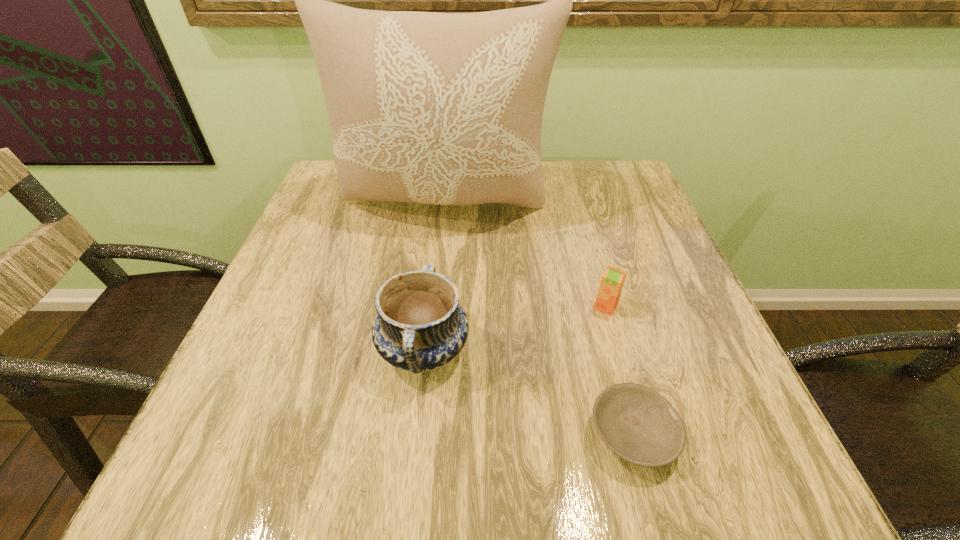
In the image, there is a desktop. Where is `vacant space at the near left corner`? The image size is (960, 540). vacant space at the near left corner is located at coordinates (179, 477).

The width and height of the screenshot is (960, 540). Find the location of `vacant space at the far right corner`. vacant space at the far right corner is located at coordinates (611, 161).

Identify the location of unoccupied position between the bowl and the orange juice. (619, 371).

At what (x,y) coordinates should I click in order to perform the action: click on vacant area between the bowl and the cushion. Please return your answer as a coordinate pair (x, y). This screenshot has width=960, height=540. Looking at the image, I should click on (540, 320).

Where is `free spot between the shortest object and the tallest object`? This screenshot has width=960, height=540. free spot between the shortest object and the tallest object is located at coordinates (540, 320).

This screenshot has height=540, width=960. In order to click on free space between the second shortest object and the tallest object in this screenshot , I will do click(526, 255).

Find the location of a particular element. This screenshot has width=960, height=540. free spot between the second tallest object and the third tallest object is located at coordinates (515, 328).

The height and width of the screenshot is (540, 960). Identify the location of free space between the pottery and the bowl. (528, 393).

This screenshot has height=540, width=960. What are the coordinates of `free space between the shortest object and the second tallest object` in the screenshot? It's located at (528, 393).

You are a GUI agent. You are given a task and a screenshot of the screen. Output one action in this format:
    pyautogui.click(x=<x>, y=<y>)
    Task: Click on the empty space that is in between the third shortest object and the shortest object
    The image size is (960, 540).
    Given the screenshot: What is the action you would take?
    pyautogui.click(x=528, y=393)